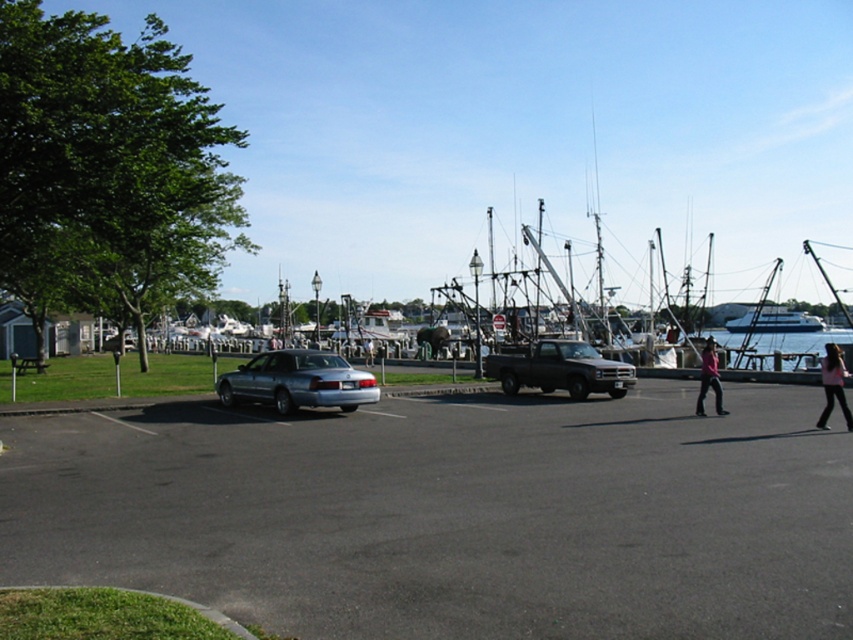
Question: Which point is farther from the camera taking this photo?

Choices:
 (A) (804, 310)
 (B) (233, 385)

Answer: (A)

Question: Is white glossy yacht at center positioned in front of pink fabric pants at right?

Choices:
 (A) no
 (B) yes

Answer: (A)

Question: Which object is the farthest from the pink fabric pants at right?

Choices:
 (A) white glossy yacht at center
 (B) pink fabric pants at lower right
 (C) clear water at lower right

Answer: (A)

Question: Which of these objects is positioned farthest from the gray asphalt parking lot at center?

Choices:
 (A) satin silver sedan at center
 (B) white glossy boat at right

Answer: (B)

Question: Can you confirm if clear water at lower right is positioned to the left of white glossy yacht at center?

Choices:
 (A) no
 (B) yes

Answer: (B)

Question: Is black matte truck at center further to camera compared to pink fabric pants at right?

Choices:
 (A) yes
 (B) no

Answer: (A)